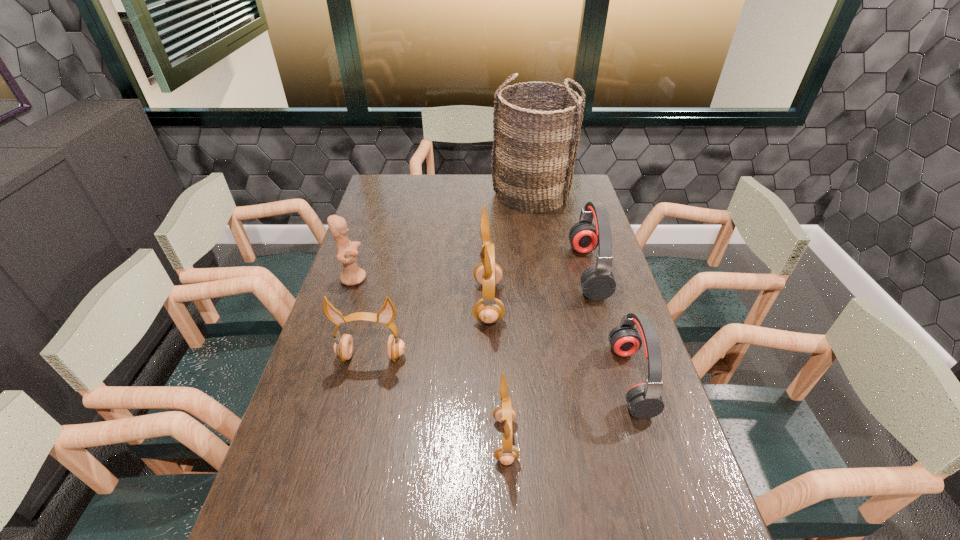
Where is `vacant area that lies between the nearest brown earphone and the biggest brown earphone`? This screenshot has width=960, height=540. vacant area that lies between the nearest brown earphone and the biggest brown earphone is located at coordinates (496, 371).

At what (x,y) coordinates should I click in order to perform the action: click on free space between the smaller red earphone and the bigger red earphone. Please return your answer as a coordinate pair (x, y). The width and height of the screenshot is (960, 540). Looking at the image, I should click on (610, 325).

Image resolution: width=960 pixels, height=540 pixels. Find the location of `object that stands as the sixth closest to the smaller red earphone`. object that stands as the sixth closest to the smaller red earphone is located at coordinates (347, 252).

Locate which object ranks in proximity to the nearer red earphone. Please provide its 2D coordinates. Your answer should be formatted as a tuple, i.e. [(x, y)], where the tuple contains the x and y coordinates of a point satisfying the conditions above.

[(598, 283)]

You are a GUI agent. You are given a task and a screenshot of the screen. Output one action in this format:
    pyautogui.click(x=<x>, y=<y>)
    Task: Click on the earphone that is the fifth closest one to the basket
    The image size is (960, 540).
    Given the screenshot: What is the action you would take?
    pyautogui.click(x=507, y=453)

The width and height of the screenshot is (960, 540). I want to click on earphone that is the fourth closest one to the leftmost earphone, so click(644, 400).

Where is `brown earphone that is the third closest to the bigger red earphone`? Image resolution: width=960 pixels, height=540 pixels. brown earphone that is the third closest to the bigger red earphone is located at coordinates (343, 347).

Select which brown earphone is the closest to the bigger red earphone. Please provide its 2D coordinates. Your answer should be formatted as a tuple, i.e. [(x, y)], where the tuple contains the x and y coordinates of a point satisfying the conditions above.

[(489, 309)]

Where is `red earphone that is the nearest to the figurine`? Image resolution: width=960 pixels, height=540 pixels. red earphone that is the nearest to the figurine is located at coordinates (598, 283).

I want to click on red earphone that is the second nearest to the second nearest brown earphone, so click(644, 400).